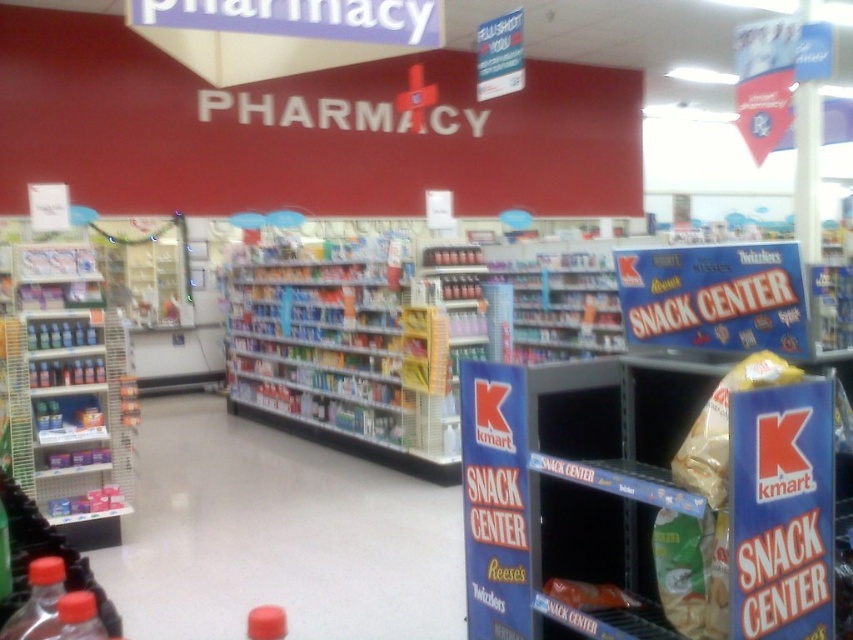
Is blue cardboard snack center at lower right behind matte plastic shelves at left?

No, blue cardboard snack center at lower right is closer to the viewer.

Between point (698, 413) and point (120, 476), which one is positioned in front?

Positioned in front is point (698, 413).

Does point (763, 508) come farther from viewer compared to point (96, 472)?

No, (763, 508) is closer to viewer.

Locate an element on the screen. blue cardboard snack center at lower right is located at coordinates point(646,499).

Who is positioned more to the right, blue cardboard snack center at lower right or matte plastic candy at center?

From the viewer's perspective, blue cardboard snack center at lower right appears more on the right side.

Can you confirm if blue cardboard snack center at lower right is wider than matte plastic candy at center?

Yes, blue cardboard snack center at lower right is wider than matte plastic candy at center.

Who is more forward, (529, 560) or (616, 586)?

Point (529, 560) is more forward.

Find the location of a particular element. blue cardboard snack center at lower right is located at coordinates (646, 499).

Does translucent plastic bottle at lower left have a lesser width compared to matte plastic candy at center?

Indeed, translucent plastic bottle at lower left has a lesser width compared to matte plastic candy at center.

Does translucent plastic bottle at lower left appear on the left side of matte plastic candy at center?

Yes, translucent plastic bottle at lower left is to the left of matte plastic candy at center.

Where is `translucent plastic bottle at lower left`? translucent plastic bottle at lower left is located at coordinates (38, 602).

The width and height of the screenshot is (853, 640). I want to click on translucent plastic bottle at lower left, so click(x=38, y=602).